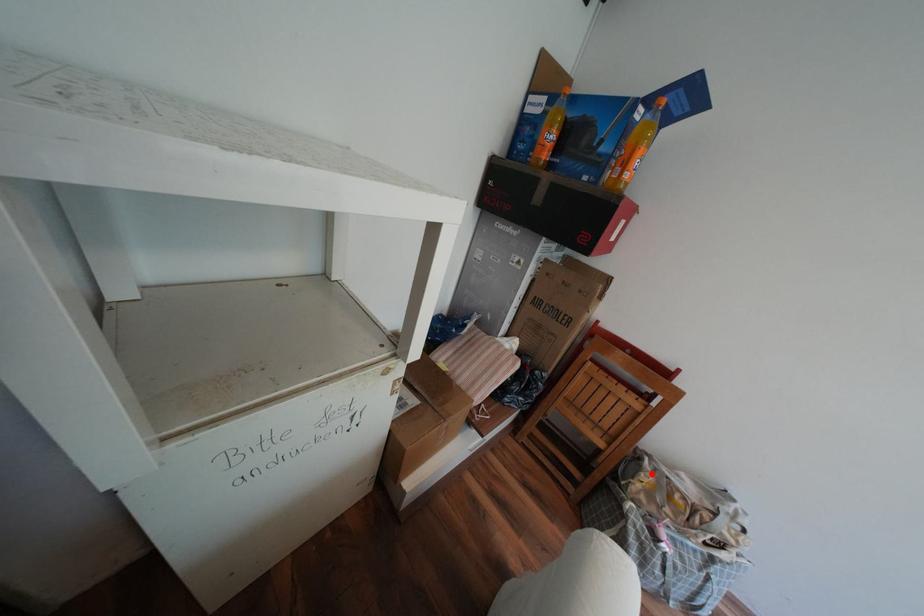
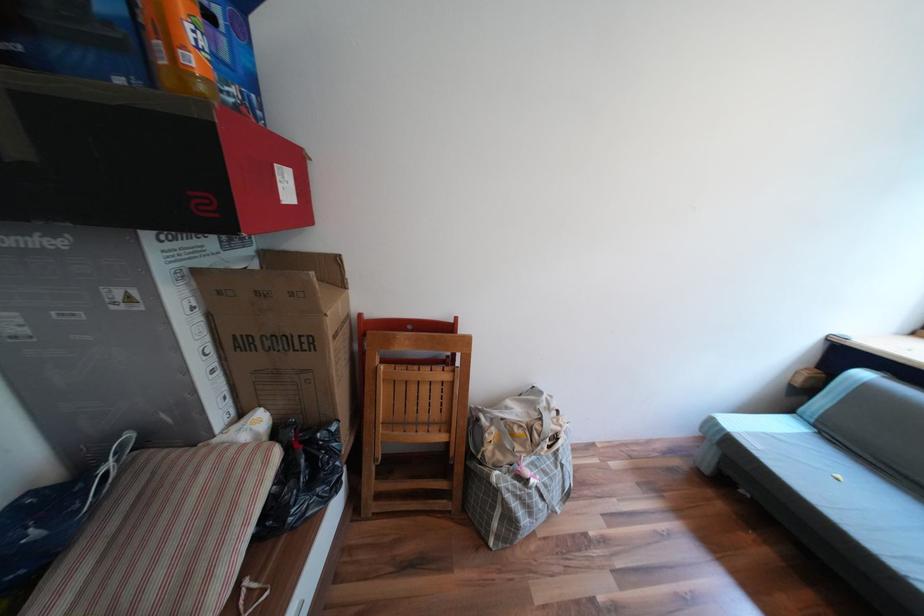
Question: A red point is marked in image1. In image2, is the corresponding 3D point closer to the camera or farther? Reply with the corresponding letter.

Choices:
 (A) The corresponding 3D point is closer.
 (B) The corresponding 3D point is farther.

Answer: (B)